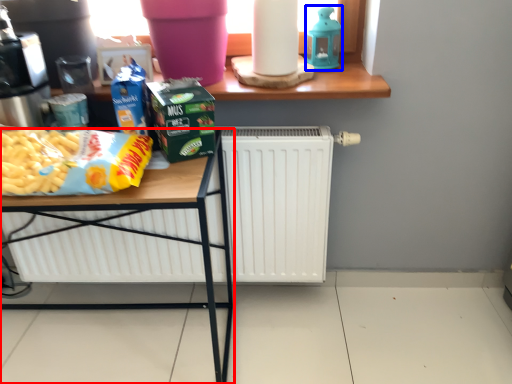
Question: Which of the following is the closest to the observer, table (highlighted by a red box) or appliance (highlighted by a blue box)?

Choices:
 (A) table
 (B) appliance

Answer: (A)